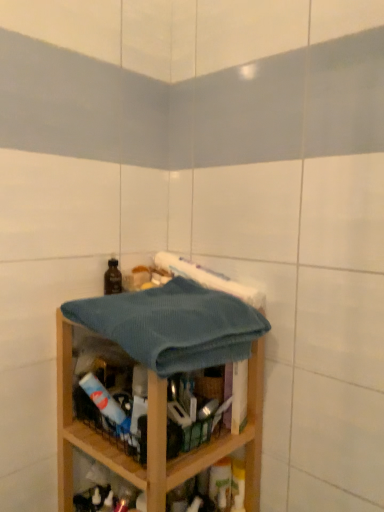
Question: Is wooden shelf at center in front of or behind teal waffle towel at center in the image?

Choices:
 (A) behind
 (B) front

Answer: (A)

Question: In terms of height, does wooden shelf at center look taller or shorter compared to teal waffle towel at center?

Choices:
 (A) tall
 (B) short

Answer: (A)

Question: Estimate the real-world distances between objects in this image. Which object is closer to the teal waffle towel at center?

Choices:
 (A) wooden shelf at center
 (B) brown matte bottle at upper left

Answer: (A)

Question: Based on their relative distances, which object is nearer to the teal waffle towel at center?

Choices:
 (A) wooden shelf at center
 (B) brown matte bottle at upper left

Answer: (A)